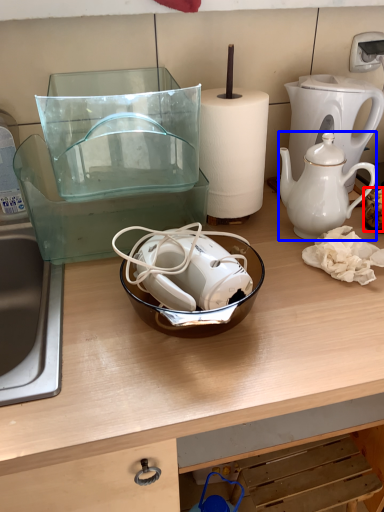
Question: Which object is further to the camera taking this photo, food (highlighted by a red box) or teapot (highlighted by a blue box)?

Choices:
 (A) food
 (B) teapot

Answer: (A)